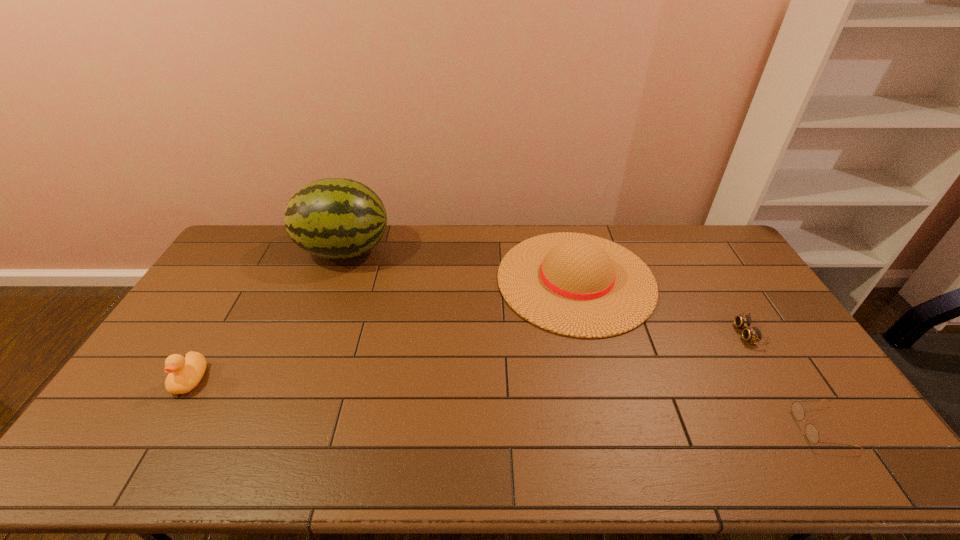
The width and height of the screenshot is (960, 540). In order to click on the fourth object from right to left in this screenshot , I will do `click(335, 218)`.

The image size is (960, 540). I want to click on the tallest object, so click(335, 218).

You are a GUI agent. You are given a task and a screenshot of the screen. Output one action in this format:
    pyautogui.click(x=<x>, y=<y>)
    Task: Click on the second tallest object
    
    Given the screenshot: What is the action you would take?
    pyautogui.click(x=578, y=285)

Identify the location of the third object from right to left. (578, 285).

Where is `the leftmost object`? the leftmost object is located at coordinates (184, 375).

Where is `duck`? duck is located at coordinates (184, 375).

At what (x,y) coordinates should I click in order to perform the action: click on goggles. Please return your answer as a coordinate pair (x, y). Looking at the image, I should click on (753, 334).

Locate an element on the screen. This screenshot has width=960, height=540. spectacles is located at coordinates (811, 432).

You are a GUI agent. You are given a task and a screenshot of the screen. Output one action in this format:
    pyautogui.click(x=<x>, y=<y>)
    Task: Click on the vacant area situated 0.210m at the stem end of the tallest object
    The height and width of the screenshot is (540, 960).
    Given the screenshot: What is the action you would take?
    pyautogui.click(x=446, y=251)

Identify the location of vacant space situated 0.280m on the front of the second tallest object. (612, 422).